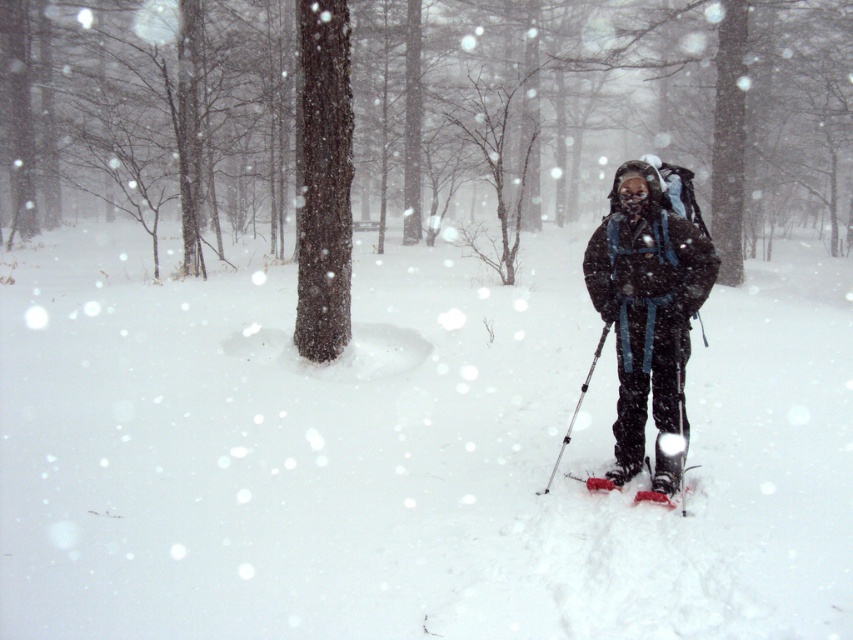
Question: Among these points, which one is nearest to the camera?

Choices:
 (A) (683, 470)
 (B) (671, 486)
 (C) (582, 381)
 (D) (332, 339)

Answer: (B)

Question: Does red plastic ski at center have a lesser width compared to metallic silver ski pole at center?

Choices:
 (A) yes
 (B) no

Answer: (B)

Question: Which point is closer to the camera?

Choices:
 (A) matte black jacket at center
 (B) red plastic ski at center
 (C) white rubber snowshoe at center
 (D) smooth dark brown tree trunk at center

Answer: (A)

Question: Can you confirm if matte black jacket at center is positioned to the left of white rubber snowshoe at center?

Choices:
 (A) yes
 (B) no

Answer: (A)

Question: Which object is closer to the camera taking this photo?

Choices:
 (A) matte black jacket at center
 (B) white rubber snowshoe at center
 (C) metallic silver ski pole at center
 (D) red plastic ski at center

Answer: (A)

Question: Does matte black jacket at center have a larger size compared to metallic silver ski pole at center?

Choices:
 (A) yes
 (B) no

Answer: (A)